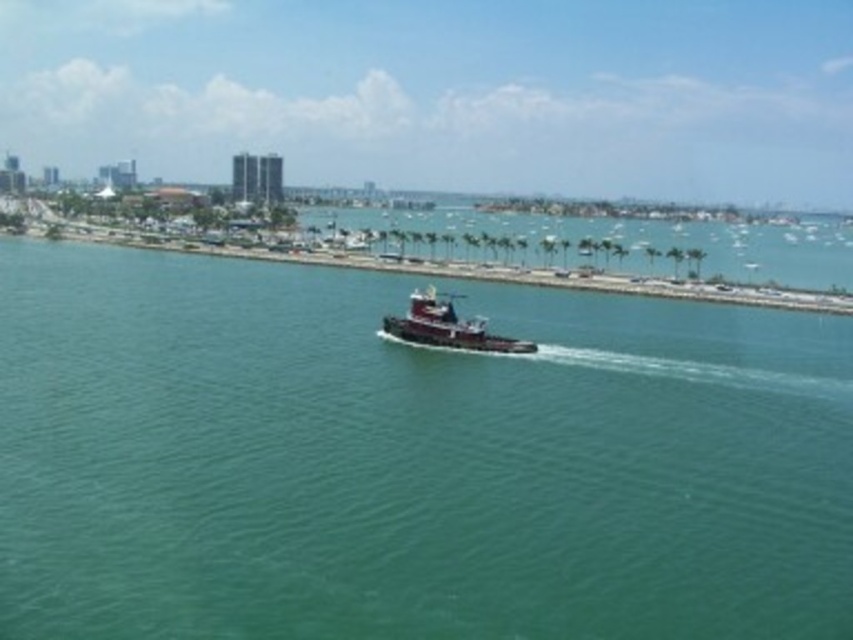
Question: Can you confirm if green water at center is wider than shiny black tugboat at center?

Choices:
 (A) no
 (B) yes

Answer: (B)

Question: Can you confirm if green water at center is positioned to the left of shiny black tugboat at center?

Choices:
 (A) no
 (B) yes

Answer: (B)

Question: Which object appears closest to the camera in this image?

Choices:
 (A) shiny black tugboat at center
 (B) green water at center

Answer: (B)

Question: Which point is farther to the camera?

Choices:
 (A) (431, 337)
 (B) (576, 518)

Answer: (A)

Question: Is green water at center bigger than shiny black tugboat at center?

Choices:
 (A) no
 (B) yes

Answer: (B)